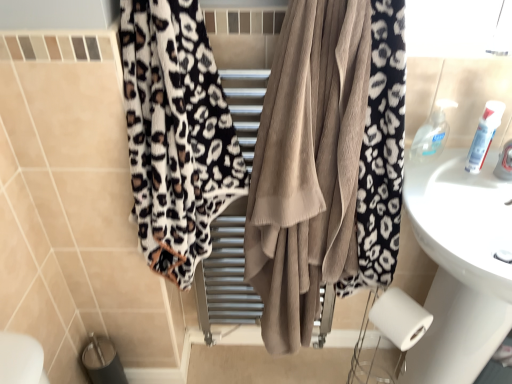
What do you see at coordinates (176, 134) in the screenshot? The height and width of the screenshot is (384, 512). I see `leopard print fabric at left, positioned as the second curtain in right-to-left order` at bounding box center [176, 134].

Image resolution: width=512 pixels, height=384 pixels. I want to click on white glossy tube at upper right, the 1th toiletry positioned from the right, so click(484, 135).

Which is behind, point (488, 150) or point (154, 102)?

The point (488, 150) is behind.

How different are the orientations of white glossy tube at upper right, which appears as the 2th toiletry when viewed from the left, and leopard print fabric at left, positioned as the second curtain in right-to-left order, in degrees?

There is a 2.28-degree angle between the facing directions of white glossy tube at upper right, which appears as the 2th toiletry when viewed from the left, and leopard print fabric at left, positioned as the second curtain in right-to-left order.

Which object is positioned more to the right, white glossy tube at upper right, which appears as the 2th toiletry when viewed from the left, or leopard print fabric at left, positioned as the second curtain in right-to-left order?

From the viewer's perspective, white glossy tube at upper right, which appears as the 2th toiletry when viewed from the left, appears more on the right side.

Could you tell me if white glossy tube at upper right, which appears as the 2th toiletry when viewed from the left, is facing leopard print fabric at left, which appears as the first curtain when viewed from the left?

No, white glossy tube at upper right, which appears as the 2th toiletry when viewed from the left, is not oriented towards leopard print fabric at left, which appears as the first curtain when viewed from the left.

Is leopard print towel at center, which is the first curtain in right-to-left order, beside clear plastic soap dispenser at upper right, the first toiletry viewed from the left?

leopard print towel at center, which is the first curtain in right-to-left order, and clear plastic soap dispenser at upper right, the first toiletry viewed from the left, are not in contact.

Is leopard print towel at center, the 2th curtain viewed from the left, inside the boundaries of clear plastic soap dispenser at upper right, the first toiletry viewed from the left, or outside?

leopard print towel at center, the 2th curtain viewed from the left, is spatially situated outside clear plastic soap dispenser at upper right, the first toiletry viewed from the left.

From a real-world perspective, which is physically below, leopard print towel at center, the 2th curtain viewed from the left, or clear plastic soap dispenser at upper right, the first toiletry viewed from the left?

leopard print towel at center, the 2th curtain viewed from the left.

From the picture: Based on their sizes in the image, would you say leopard print towel at center, which is the first curtain in right-to-left order, is bigger or smaller than clear plastic soap dispenser at upper right, the second toiletry when ordered from right to left?

Clearly, leopard print towel at center, which is the first curtain in right-to-left order, is larger in size than clear plastic soap dispenser at upper right, the second toiletry when ordered from right to left.

Would you say leopard print fabric at left, which appears as the first curtain when viewed from the left, is inside or outside clear plastic soap dispenser at upper right, the second toiletry when ordered from right to left?

leopard print fabric at left, which appears as the first curtain when viewed from the left, is outside clear plastic soap dispenser at upper right, the second toiletry when ordered from right to left.

Are leopard print fabric at left, positioned as the second curtain in right-to-left order, and clear plastic soap dispenser at upper right, the second toiletry when ordered from right to left, far apart?

Actually, leopard print fabric at left, positioned as the second curtain in right-to-left order, and clear plastic soap dispenser at upper right, the second toiletry when ordered from right to left, are a little close together.

In terms of height, does leopard print fabric at left, which appears as the first curtain when viewed from the left, look taller or shorter compared to clear plastic soap dispenser at upper right, the second toiletry when ordered from right to left?

leopard print fabric at left, which appears as the first curtain when viewed from the left, is taller than clear plastic soap dispenser at upper right, the second toiletry when ordered from right to left.

Would you say leopard print fabric at left, which appears as the first curtain when viewed from the left, is outside leopard print towel at center, the 2th curtain viewed from the left?

That's correct, leopard print fabric at left, which appears as the first curtain when viewed from the left, is outside of leopard print towel at center, the 2th curtain viewed from the left.

Does point (184, 162) lie in front of point (253, 269)?

Yes, point (184, 162) is closer to viewer.

I want to click on curtain to the right of leopard print fabric at left, positioned as the second curtain in right-to-left order, so click(308, 166).

Is leopard print fabric at left, positioned as the second curtain in right-to-left order, oriented away from leopard print towel at center, the 2th curtain viewed from the left?

Yes, leopard print fabric at left, positioned as the second curtain in right-to-left order, is facing away from leopard print towel at center, the 2th curtain viewed from the left.

Can you confirm if leopard print towel at center, which is the first curtain in right-to-left order, is shorter than white glossy tube at upper right, which appears as the 2th toiletry when viewed from the left?

In fact, leopard print towel at center, which is the first curtain in right-to-left order, may be taller than white glossy tube at upper right, which appears as the 2th toiletry when viewed from the left.

In the scene shown: From a real-world perspective, between leopard print towel at center, the 2th curtain viewed from the left, and white glossy tube at upper right, the 1th toiletry positioned from the right, who is vertically higher?

white glossy tube at upper right, the 1th toiletry positioned from the right.

Considering the positions of objects leopard print towel at center, which is the first curtain in right-to-left order, and white glossy tube at upper right, the 1th toiletry positioned from the right, in the image provided, who is more to the right, leopard print towel at center, which is the first curtain in right-to-left order, or white glossy tube at upper right, the 1th toiletry positioned from the right,?

From the viewer's perspective, white glossy tube at upper right, the 1th toiletry positioned from the right, appears more on the right side.

Is leopard print towel at center, the 2th curtain viewed from the left, far away from white glossy tube at upper right, which appears as the 2th toiletry when viewed from the left?

Actually, leopard print towel at center, the 2th curtain viewed from the left, and white glossy tube at upper right, which appears as the 2th toiletry when viewed from the left, are a little close together.

Considering the sizes of objects white glossy tube at upper right, which appears as the 2th toiletry when viewed from the left, and leopard print towel at center, the 2th curtain viewed from the left, in the image provided, who is wider, white glossy tube at upper right, which appears as the 2th toiletry when viewed from the left, or leopard print towel at center, the 2th curtain viewed from the left,?

leopard print towel at center, the 2th curtain viewed from the left, is wider.

Is white glossy tube at upper right, which appears as the 2th toiletry when viewed from the left, positioned beyond the bounds of leopard print towel at center, the 2th curtain viewed from the left?

Absolutely, white glossy tube at upper right, which appears as the 2th toiletry when viewed from the left, is external to leopard print towel at center, the 2th curtain viewed from the left.

Considering the positions of objects white glossy tube at upper right, which appears as the 2th toiletry when viewed from the left, and leopard print towel at center, the 2th curtain viewed from the left, in the image provided, who is behind, white glossy tube at upper right, which appears as the 2th toiletry when viewed from the left, or leopard print towel at center, the 2th curtain viewed from the left,?

white glossy tube at upper right, which appears as the 2th toiletry when viewed from the left, is further away from the camera.

Is white glossy tube at upper right, the 1th toiletry positioned from the right, turned away from leopard print towel at center, which is the first curtain in right-to-left order?

white glossy tube at upper right, the 1th toiletry positioned from the right, is not turned away from leopard print towel at center, which is the first curtain in right-to-left order.

Could you tell me if clear plastic soap dispenser at upper right, the first toiletry viewed from the left, is facing white glossy tube at upper right, which appears as the 2th toiletry when viewed from the left?

No, clear plastic soap dispenser at upper right, the first toiletry viewed from the left, is not turned towards white glossy tube at upper right, which appears as the 2th toiletry when viewed from the left.

Considering the sizes of clear plastic soap dispenser at upper right, the first toiletry viewed from the left, and white glossy tube at upper right, the 1th toiletry positioned from the right, in the image, is clear plastic soap dispenser at upper right, the first toiletry viewed from the left, bigger or smaller than white glossy tube at upper right, the 1th toiletry positioned from the right,?

In the image, clear plastic soap dispenser at upper right, the first toiletry viewed from the left, appears to be larger than white glossy tube at upper right, the 1th toiletry positioned from the right.

From the image's perspective, is clear plastic soap dispenser at upper right, the second toiletry when ordered from right to left, above white glossy tube at upper right, which appears as the 2th toiletry when viewed from the left?

Correct, clear plastic soap dispenser at upper right, the second toiletry when ordered from right to left, appears higher than white glossy tube at upper right, which appears as the 2th toiletry when viewed from the left, in the image.

Measure the distance between clear plastic soap dispenser at upper right, the first toiletry viewed from the left, and white glossy tube at upper right, which appears as the 2th toiletry when viewed from the left.

clear plastic soap dispenser at upper right, the first toiletry viewed from the left, is 3.70 inches from white glossy tube at upper right, which appears as the 2th toiletry when viewed from the left.

Find the location of a particular element. toiletry that is the 2nd object to the right of the leopard print fabric at left, which appears as the first curtain when viewed from the left, starting at the anchor is located at coordinates (484, 135).

The image size is (512, 384). I want to click on toiletry that is the 2nd one when counting backward from the leopard print towel at center, the 2th curtain viewed from the left, so click(432, 134).

Which object lies nearer to the anchor point leopard print fabric at left, positioned as the second curtain in right-to-left order, white glossy tube at upper right, which appears as the 2th toiletry when viewed from the left, or clear plastic soap dispenser at upper right, the second toiletry when ordered from right to left?

clear plastic soap dispenser at upper right, the second toiletry when ordered from right to left, lies closer to leopard print fabric at left, positioned as the second curtain in right-to-left order, than the other object.

Based on the photo, based on their spatial positions, is white glossy tube at upper right, the 1th toiletry positioned from the right, or leopard print fabric at left, which appears as the first curtain when viewed from the left, further from clear plastic soap dispenser at upper right, the second toiletry when ordered from right to left?

Based on the image, leopard print fabric at left, which appears as the first curtain when viewed from the left, appears to be further to clear plastic soap dispenser at upper right, the second toiletry when ordered from right to left.

When comparing their distances from white glossy tube at upper right, the 1th toiletry positioned from the right, does clear plastic soap dispenser at upper right, the second toiletry when ordered from right to left, or leopard print fabric at left, positioned as the second curtain in right-to-left order, seem closer?

clear plastic soap dispenser at upper right, the second toiletry when ordered from right to left, is closer to white glossy tube at upper right, the 1th toiletry positioned from the right.

Considering their positions, is leopard print fabric at left, positioned as the second curtain in right-to-left order, positioned further to clear plastic soap dispenser at upper right, the first toiletry viewed from the left, than leopard print towel at center, which is the first curtain in right-to-left order?

Based on the image, leopard print fabric at left, positioned as the second curtain in right-to-left order, appears to be further to clear plastic soap dispenser at upper right, the first toiletry viewed from the left.

Which object lies nearer to the anchor point clear plastic soap dispenser at upper right, the first toiletry viewed from the left, leopard print towel at center, the 2th curtain viewed from the left, or white glossy tube at upper right, which appears as the 2th toiletry when viewed from the left?

white glossy tube at upper right, which appears as the 2th toiletry when viewed from the left, lies closer to clear plastic soap dispenser at upper right, the first toiletry viewed from the left, than the other object.

From the image, which object appears to be nearer to white glossy tube at upper right, which appears as the 2th toiletry when viewed from the left, leopard print towel at center, the 2th curtain viewed from the left, or leopard print fabric at left, positioned as the second curtain in right-to-left order?

Based on the image, leopard print towel at center, the 2th curtain viewed from the left, appears to be nearer to white glossy tube at upper right, which appears as the 2th toiletry when viewed from the left.

When comparing their distances from leopard print fabric at left, which appears as the first curtain when viewed from the left, does clear plastic soap dispenser at upper right, the first toiletry viewed from the left, or white glossy tube at upper right, which appears as the 2th toiletry when viewed from the left, seem closer?

The object closer to leopard print fabric at left, which appears as the first curtain when viewed from the left, is clear plastic soap dispenser at upper right, the first toiletry viewed from the left.

Estimate the real-world distances between objects in this image. Which object is closer to leopard print fabric at left, positioned as the second curtain in right-to-left order, leopard print towel at center, the 2th curtain viewed from the left, or clear plastic soap dispenser at upper right, the first toiletry viewed from the left?

leopard print towel at center, the 2th curtain viewed from the left, lies closer to leopard print fabric at left, positioned as the second curtain in right-to-left order, than the other object.

Identify the location of toiletry located between leopard print towel at center, which is the first curtain in right-to-left order, and white glossy tube at upper right, the 1th toiletry positioned from the right, in the left-right direction. point(432,134).

Locate an element on the screen. The height and width of the screenshot is (384, 512). toiletry between leopard print fabric at left, which appears as the first curtain when viewed from the left, and white glossy tube at upper right, the 1th toiletry positioned from the right, in the horizontal direction is located at coordinates (432, 134).

Locate an element on the screen. This screenshot has height=384, width=512. curtain between leopard print fabric at left, positioned as the second curtain in right-to-left order, and white glossy tube at upper right, which appears as the 2th toiletry when viewed from the left, in the horizontal direction is located at coordinates (308, 166).

You are a GUI agent. You are given a task and a screenshot of the screen. Output one action in this format:
    pyautogui.click(x=<x>, y=<y>)
    Task: Click on the curtain between leopard print fabric at left, which appears as the first curtain when viewed from the left, and clear plastic soap dispenser at upper right, the first toiletry viewed from the left
    The width and height of the screenshot is (512, 384).
    Given the screenshot: What is the action you would take?
    pyautogui.click(x=308, y=166)